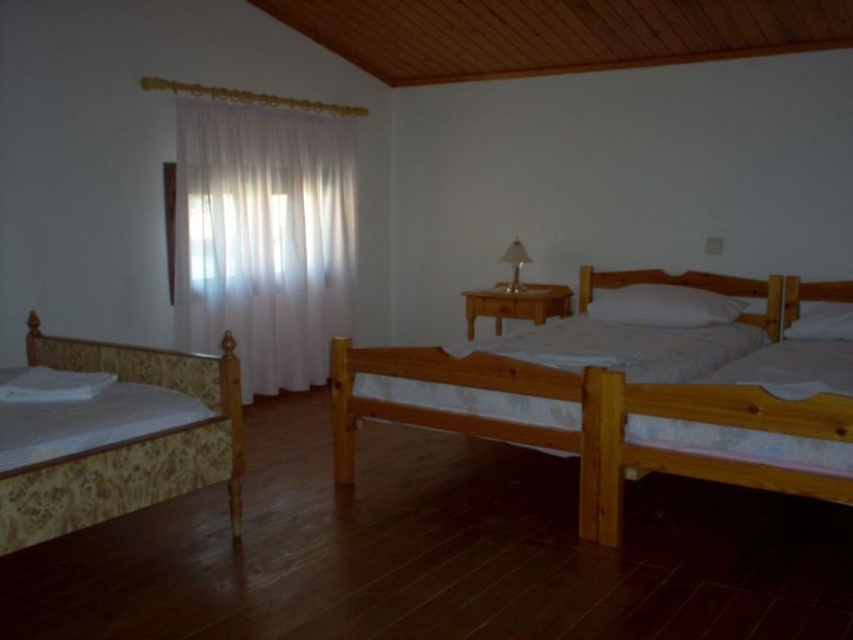
Question: Is patterned wood bed at left to the right of light brown wooden bed at right from the viewer's perspective?

Choices:
 (A) no
 (B) yes

Answer: (A)

Question: From the image, what is the correct spatial relationship of white soft pillow at lower left in relation to matte silver lamp at center?

Choices:
 (A) above
 (B) below

Answer: (B)

Question: Estimate the real-world distances between objects in this image. Which object is farther from the white soft pillow at lower left?

Choices:
 (A) patterned wood bed at left
 (B) light brown wooden bed at center

Answer: (B)

Question: Is white soft pillow at lower left to the right of white soft pillow at right from the viewer's perspective?

Choices:
 (A) yes
 (B) no

Answer: (B)

Question: Which of these objects is positioned farthest from the white sheer curtain at left?

Choices:
 (A) white soft pillow at right
 (B) white soft pillow at lower left

Answer: (A)

Question: Which point appears closest to the camera in this image?

Choices:
 (A) (637, 289)
 (B) (148, 372)

Answer: (B)